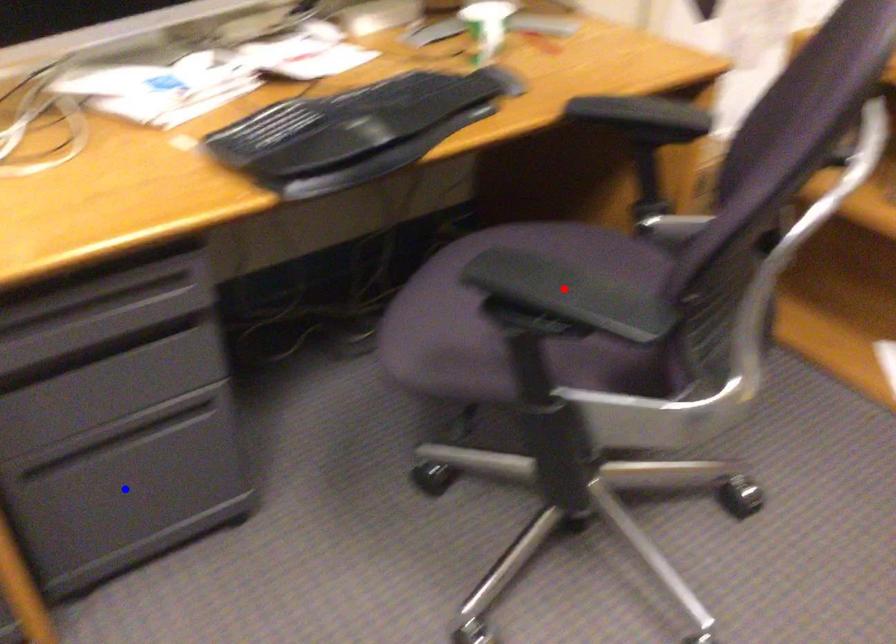
Question: In the image, two points are highlighted. Which point is nearer to the camera? Reply with the corresponding letter.

Choices:
 (A) blue point
 (B) red point

Answer: (B)